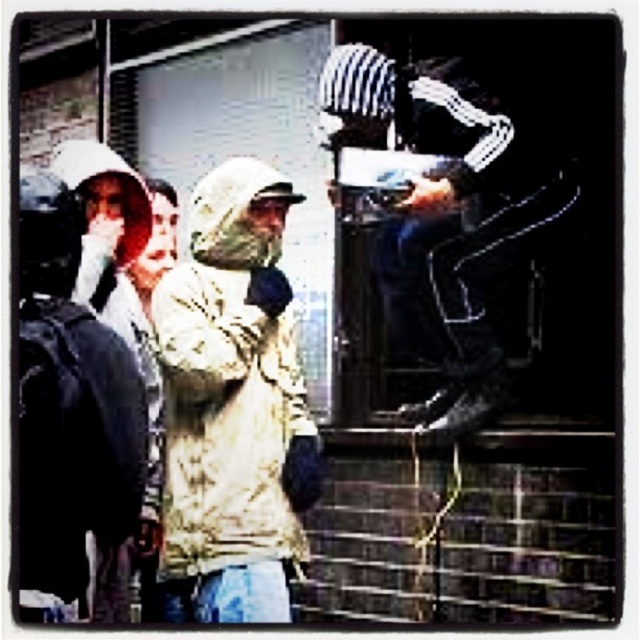
Does white plastic bag at upper right appear on the right side of matte black backpack at left?

Correct, you'll find white plastic bag at upper right to the right of matte black backpack at left.

The image size is (640, 640). What are the coordinates of `white plastic bag at upper right` in the screenshot? It's located at (442, 218).

Can you confirm if tan quilted fabric trench coat at center is bigger than white plastic bag at upper right?

No, tan quilted fabric trench coat at center is not bigger than white plastic bag at upper right.

Does tan quilted fabric trench coat at center have a greater height compared to white plastic bag at upper right?

Correct, tan quilted fabric trench coat at center is much taller as white plastic bag at upper right.

Which is behind, point (193, 348) or point (412, 202)?

Positioned behind is point (193, 348).

Where is `tan quilted fabric trench coat at center`? This screenshot has height=640, width=640. tan quilted fabric trench coat at center is located at coordinates (232, 406).

Is tan quilted fabric trench coat at center thinner than matte black backpack at left?

No, tan quilted fabric trench coat at center is not thinner than matte black backpack at left.

Is tan quilted fabric trench coat at center taller than matte black backpack at left?

Yes.

Describe the element at coordinates (232, 406) in the screenshot. I see `tan quilted fabric trench coat at center` at that location.

Find the location of a particular element. This screenshot has width=640, height=640. tan quilted fabric trench coat at center is located at coordinates (232, 406).